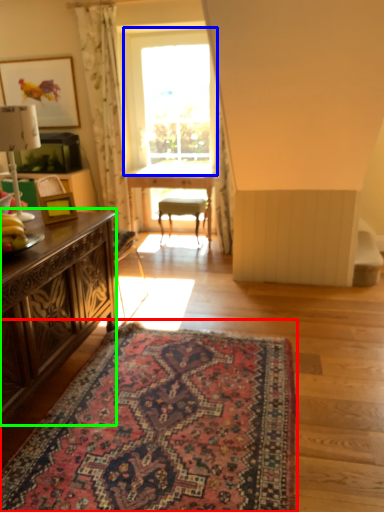
Question: Which object is the farthest from mat (highlighted by a red box)? Choose among these: window (highlighted by a blue box) or desk (highlighted by a green box).

Choices:
 (A) window
 (B) desk

Answer: (A)